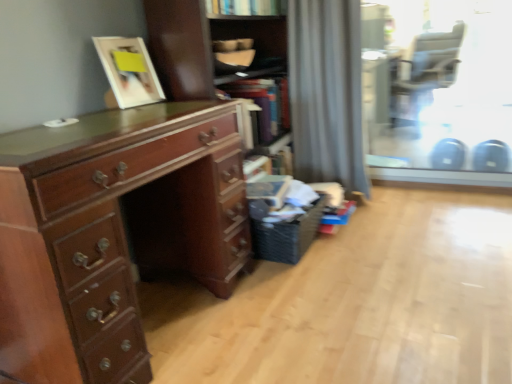
Question: Is matte black armchair at upper right positioned before gray fabric curtain at center?

Choices:
 (A) yes
 (B) no

Answer: (B)

Question: Can you confirm if matte black armchair at upper right is thinner than gray fabric curtain at center?

Choices:
 (A) no
 (B) yes

Answer: (A)

Question: Is matte black armchair at upper right in contact with gray fabric curtain at center?

Choices:
 (A) yes
 (B) no

Answer: (B)

Question: From the image's perspective, does matte black armchair at upper right appear higher than gray fabric curtain at center?

Choices:
 (A) no
 (B) yes

Answer: (B)

Question: Does matte black armchair at upper right have a greater height compared to gray fabric curtain at center?

Choices:
 (A) yes
 (B) no

Answer: (B)

Question: Visually, is matte black armchair at upper right positioned to the left or to the right of matte white picture frame at upper left?

Choices:
 (A) right
 (B) left

Answer: (A)

Question: Considering the positions of matte black armchair at upper right and matte white picture frame at upper left in the image, is matte black armchair at upper right bigger or smaller than matte white picture frame at upper left?

Choices:
 (A) small
 (B) big

Answer: (B)

Question: In terms of width, does matte black armchair at upper right look wider or thinner when compared to matte white picture frame at upper left?

Choices:
 (A) wide
 (B) thin

Answer: (A)

Question: Which is correct: matte black armchair at upper right is inside matte white picture frame at upper left, or outside of it?

Choices:
 (A) outside
 (B) inside

Answer: (A)

Question: From the image's perspective, relative to transparent glass door at upper right, is black woven laundry basket at lower right above or below?

Choices:
 (A) below
 (B) above

Answer: (A)

Question: Is black woven laundry basket at lower right spatially inside transparent glass door at upper right, or outside of it?

Choices:
 (A) outside
 (B) inside

Answer: (A)

Question: Is black woven laundry basket at lower right in front of or behind transparent glass door at upper right in the image?

Choices:
 (A) behind
 (B) front

Answer: (B)

Question: From a real-world perspective, relative to transparent glass door at upper right, is black woven laundry basket at lower right vertically above or below?

Choices:
 (A) above
 (B) below

Answer: (B)

Question: From a real-world perspective, relative to shiny brown wooden desk at left, is wooden cabinet at center vertically above or below?

Choices:
 (A) below
 (B) above

Answer: (B)

Question: In terms of height, does wooden cabinet at center look taller or shorter compared to shiny brown wooden desk at left?

Choices:
 (A) tall
 (B) short

Answer: (A)